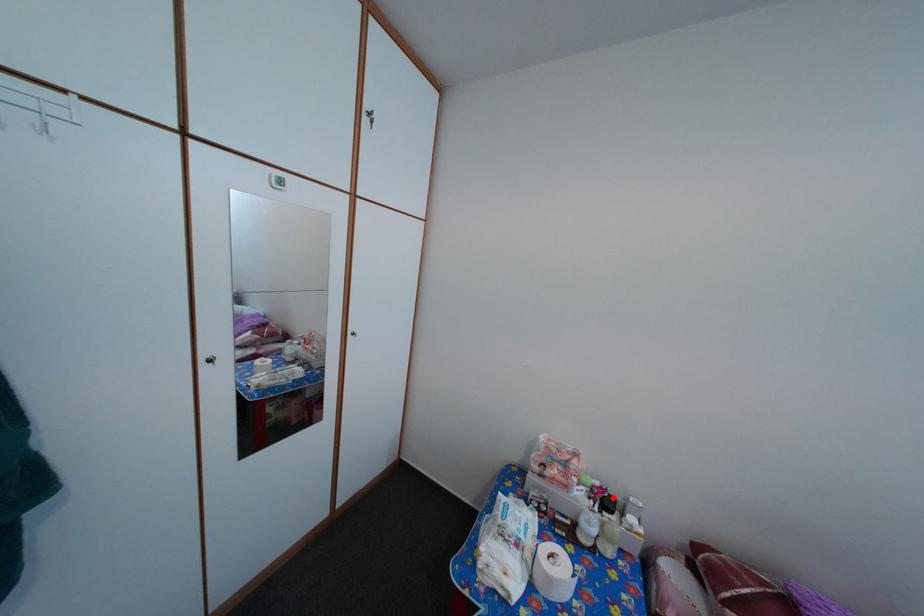
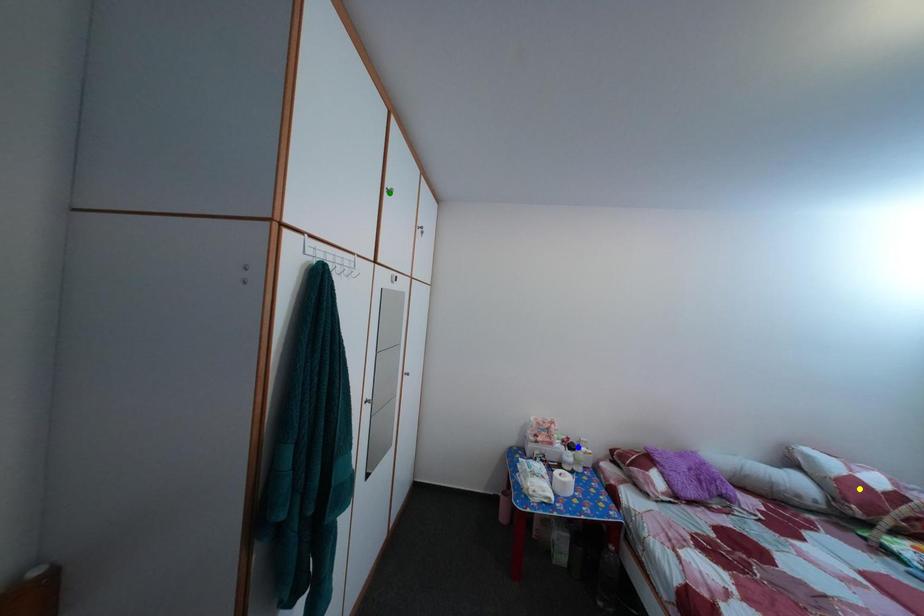
Question: I am providing you with two images of the same scene from different viewpoints. A red point is marked on the first image. You are given multiple points on the second image. Can you choose the point in image 2 that corresponds to the point in image 1?

Choices:
 (A) green point
 (B) blue point
 (C) yellow point

Answer: (B)